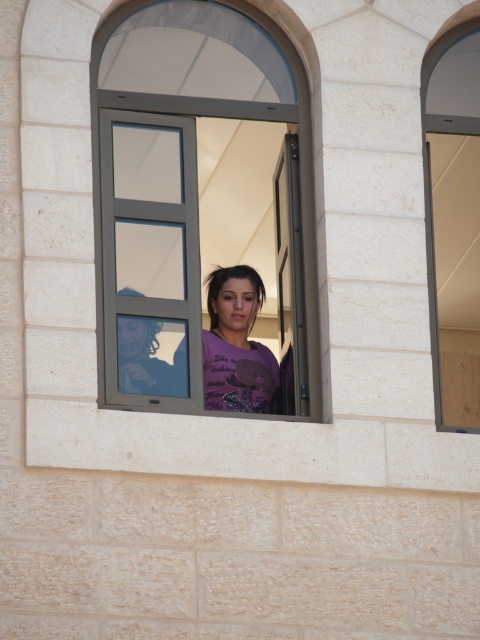
Between point (450, 324) and point (226, 337), which one is positioned behind?

Positioned behind is point (450, 324).

Measure the distance between matte gray window at right and purple matte shirt at center.

They are 7.64 meters apart.

Who is more distant from viewer, [425,128] or [224,381]?

The point [224,381] is behind.

Locate an element on the screen. The height and width of the screenshot is (640, 480). matte gray window at right is located at coordinates (453, 220).

Looking at this image, who is more forward, (113, 380) or (225, 323)?

Positioned in front is point (113, 380).

Is metallic gray window at center taller than purple matte shirt at center?

Yes.

Measure the distance between point (284,225) and camera.

Point (284,225) is 60.14 meters from camera.

Find the location of `metallic gray window at center`. metallic gray window at center is located at coordinates (203, 211).

Does metallic gray window at center come in front of matte gray window at right?

Yes, metallic gray window at center is closer to the viewer.

Who is shorter, metallic gray window at center or matte gray window at right?

Standing shorter between the two is metallic gray window at center.

Is point (96, 182) farther from camera compared to point (471, 77)?

No, (96, 182) is in front of (471, 77).

At what (x,y) coordinates should I click in order to perform the action: click on metallic gray window at center. Please return your answer as a coordinate pair (x, y). The image size is (480, 640). Looking at the image, I should click on pyautogui.click(x=203, y=211).